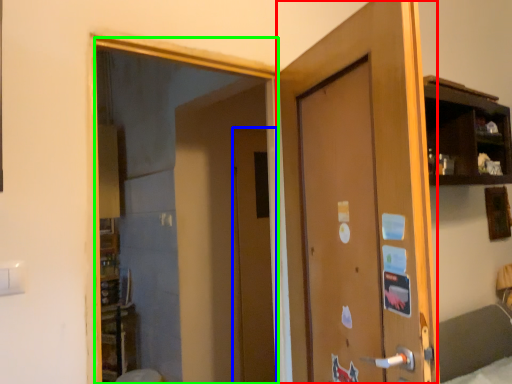
Question: Estimate the real-world distances between objects in this image. Which object is farther from door (highlighted by a red box), door (highlighted by a blue box) or mirror (highlighted by a green box)?

Choices:
 (A) door
 (B) mirror

Answer: (A)